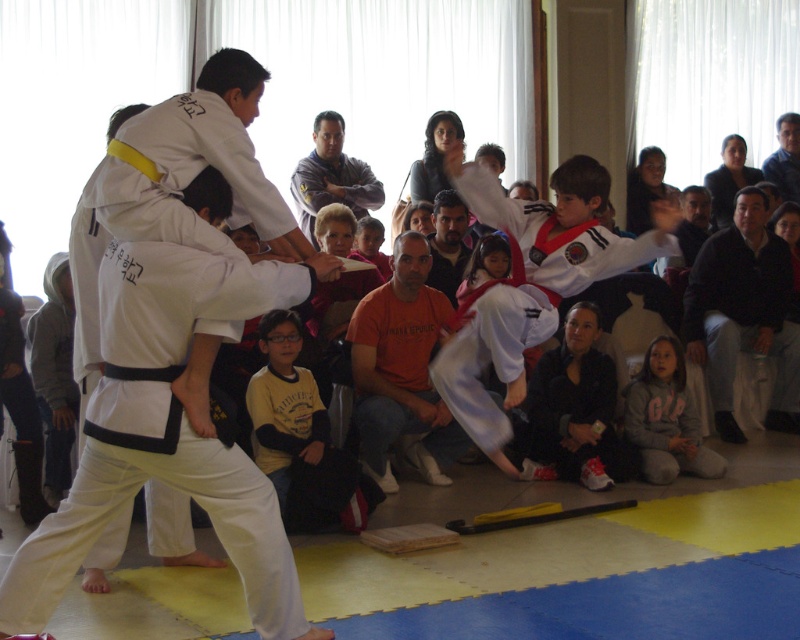
Is point (450, 212) closer to viewer compared to point (736, 188)?

Yes, point (450, 212) is closer to viewer.

Is point (460, 205) farther from viewer compared to point (716, 195)?

No, (460, 205) is in front of (716, 195).

Where is `orange cotton shirt at center`? orange cotton shirt at center is located at coordinates (448, 243).

Image resolution: width=800 pixels, height=640 pixels. I want to click on orange cotton shirt at center, so click(x=448, y=243).

Does black cotton shirt at upper right appear over yellow long-sleeve shirt at lower center?

Correct, black cotton shirt at upper right is located above yellow long-sleeve shirt at lower center.

Can you confirm if black cotton shirt at upper right is positioned to the right of yellow long-sleeve shirt at lower center?

Yes, black cotton shirt at upper right is to the right of yellow long-sleeve shirt at lower center.

Does point (684, 337) come behind point (278, 500)?

Yes.

Locate an element on the screen. This screenshot has height=640, width=800. black cotton shirt at upper right is located at coordinates 744,314.

Does point (404, 352) lie behind point (438, 227)?

No.

The height and width of the screenshot is (640, 800). I want to click on orange cotton t-shirt at center, so click(401, 369).

Identify the location of orange cotton t-shirt at center. (401, 369).